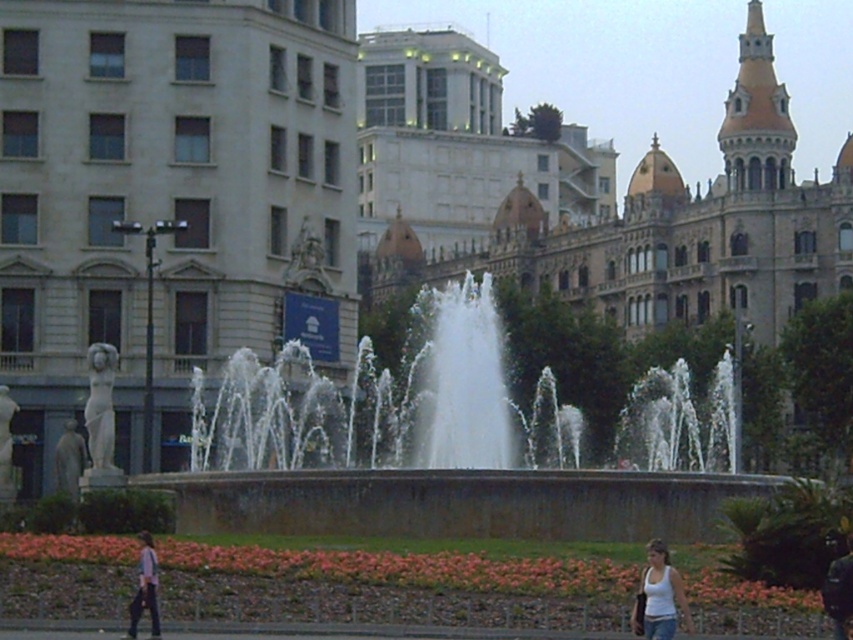
Question: Which object is closer to the camera taking this photo?

Choices:
 (A) dark brown leather jacket at lower right
 (B) white cotton tank top at lower right
 (C) golden stone palace at center

Answer: (A)

Question: Is white cotton tank top at lower right further to the viewer compared to light pink shirt at lower left?

Choices:
 (A) no
 (B) yes

Answer: (B)

Question: Is golden stone palace at center closer to the viewer compared to dark brown leather jacket at lower right?

Choices:
 (A) yes
 (B) no

Answer: (B)

Question: Does white cotton tank top at lower right have a larger size compared to dark brown leather jacket at lower right?

Choices:
 (A) yes
 (B) no

Answer: (B)

Question: Estimate the real-world distances between objects in this image. Which object is farther from the white stone fountain at center?

Choices:
 (A) light pink shirt at lower left
 (B) dark brown leather jacket at lower right
 (C) golden stone palace at center

Answer: (A)

Question: Which object appears farthest from the camera in this image?

Choices:
 (A) white cotton tank top at lower right
 (B) white stone fountain at center
 (C) light pink shirt at lower left
 (D) smooth gray statue at left

Answer: (D)